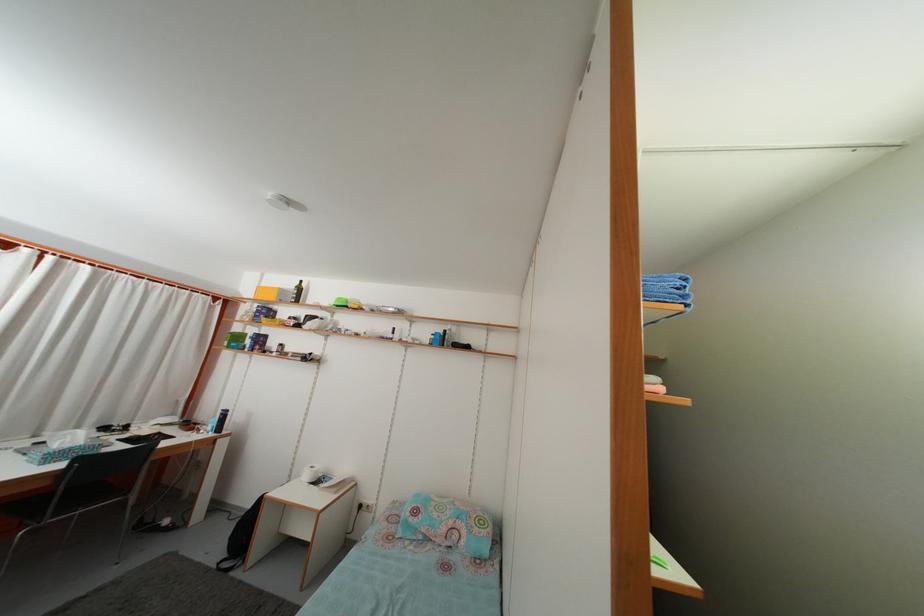
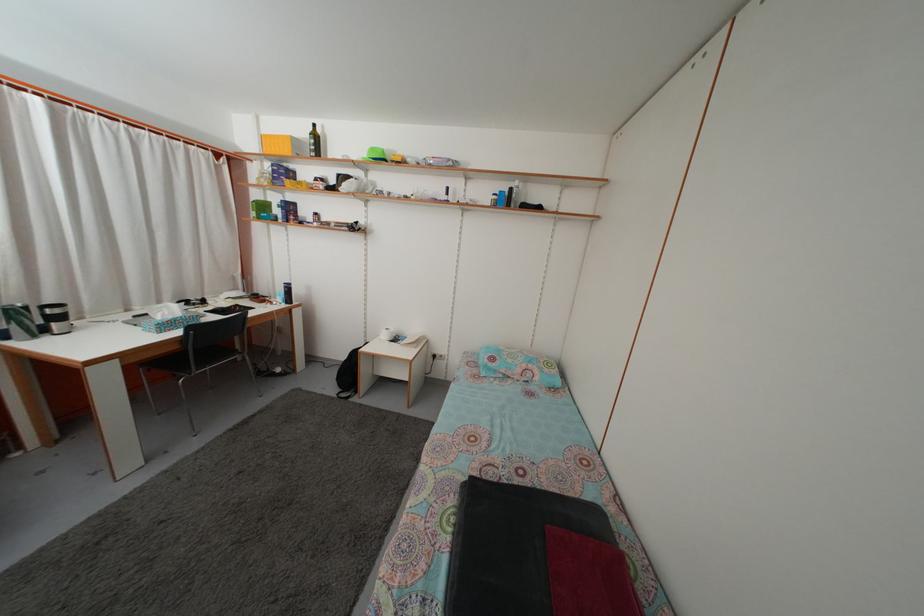
Question: What movement of the cameraman would produce the second image?

Choices:
 (A) Left
 (B) Right
 (C) Forward
 (D) Backward

Answer: (A)